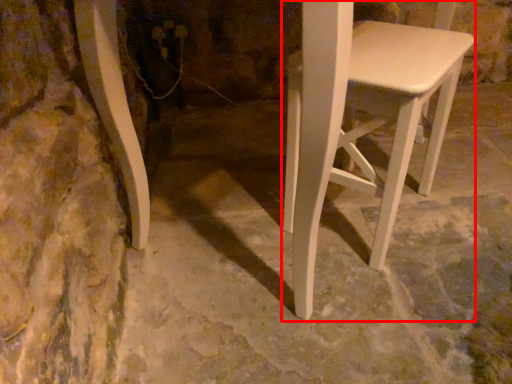
Question: From the image's perspective, considering the relative positions of stool (annotated by the red box) and concrete in the image provided, where is stool (annotated by the red box) located with respect to the staircase?

Choices:
 (A) above
 (B) below

Answer: (A)